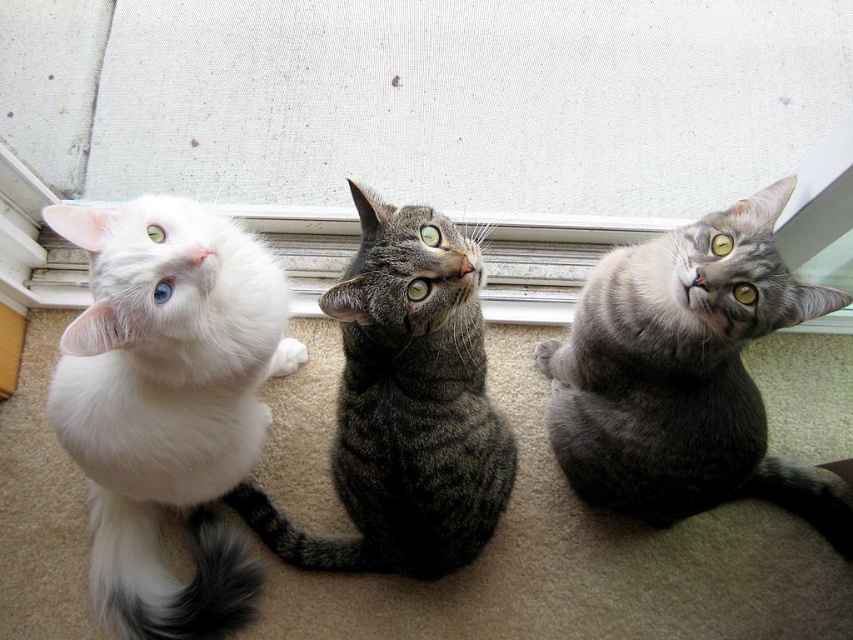
Question: Which object is positioned farthest from the white fabric window at upper center?

Choices:
 (A) gray tabby cat at center
 (B) white fluffy cat at left

Answer: (B)

Question: Does white fabric window at upper center appear under white fluffy cat at left?

Choices:
 (A) yes
 (B) no

Answer: (B)

Question: Which point is farther to the camera?

Choices:
 (A) (265, 506)
 (B) (119, 397)
 (C) (137, 160)
 (D) (607, 282)

Answer: (C)

Question: Which is nearer to the gray tabby cat at center?

Choices:
 (A) white fabric window at upper center
 (B) white fluffy cat at left
 (C) tabby fur cat at center

Answer: (C)

Question: Does white fluffy cat at left come behind tabby fur cat at center?

Choices:
 (A) no
 (B) yes

Answer: (A)

Question: Is gray tabby cat at center closer to the viewer compared to tabby fur cat at center?

Choices:
 (A) yes
 (B) no

Answer: (B)